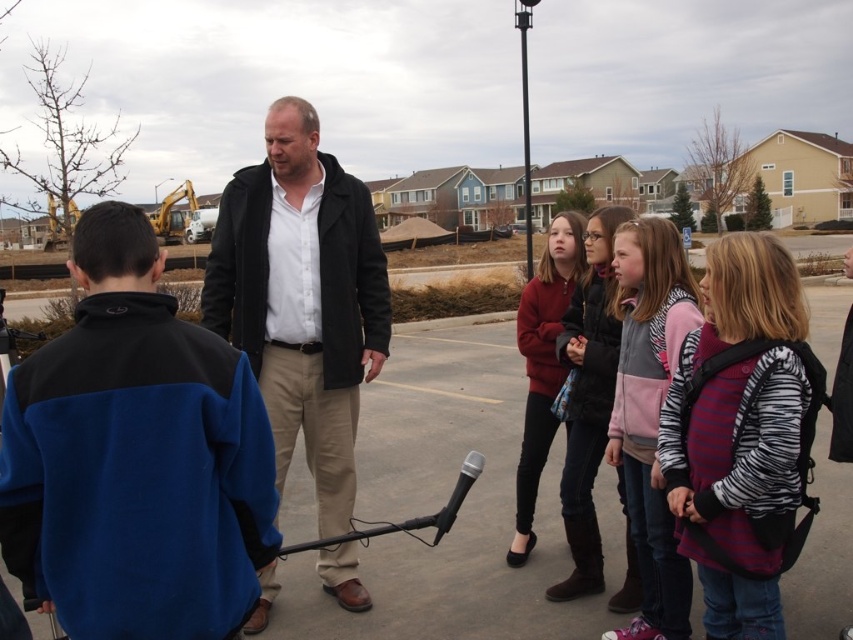
Is point (225, 237) farther from viewer compared to point (648, 598)?

That is True.

At what (x,y) coordinates should I click in order to perform the action: click on matte black jacket at center. Please return your answer as a coordinate pair (x, y). This screenshot has height=640, width=853. Looking at the image, I should click on (302, 298).

You are a GUI agent. You are given a task and a screenshot of the screen. Output one action in this format:
    pyautogui.click(x=<x>, y=<y>)
    Task: Click on the matte black jacket at center
    This screenshot has width=853, height=640.
    Given the screenshot: What is the action you would take?
    pyautogui.click(x=302, y=298)

Is point (738, 236) positioned after point (660, 253)?

That is False.

Is zebra-patterned backpack at center-right further to camera compared to zebra print jacket at center?

That is False.

Does point (734, 452) lie behind point (689, 300)?

That is False.

Find the location of `zebra-patterned backpack at center-right`. zebra-patterned backpack at center-right is located at coordinates [740, 433].

Is matte black jacket at center closer to camera compared to matte red sweater at center?

That is True.

Can you confirm if matte black jacket at center is positioned to the right of matte red sweater at center?

In fact, matte black jacket at center is to the left of matte red sweater at center.

Is point (355, 371) farther from viewer compared to point (547, 380)?

That is False.

At what (x,y) coordinates should I click in order to perform the action: click on matte black jacket at center. Please return your answer as a coordinate pair (x, y). The image size is (853, 640). Looking at the image, I should click on (302, 298).